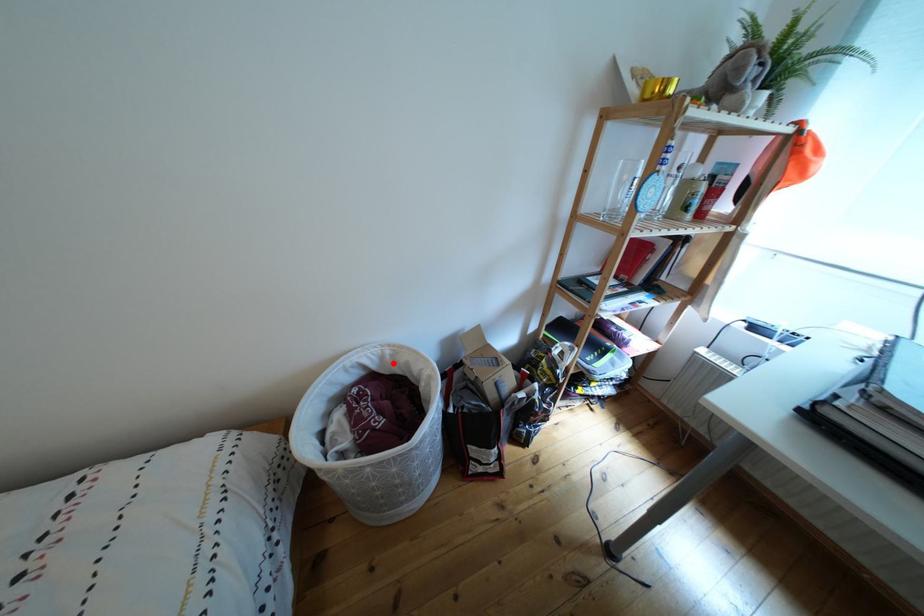
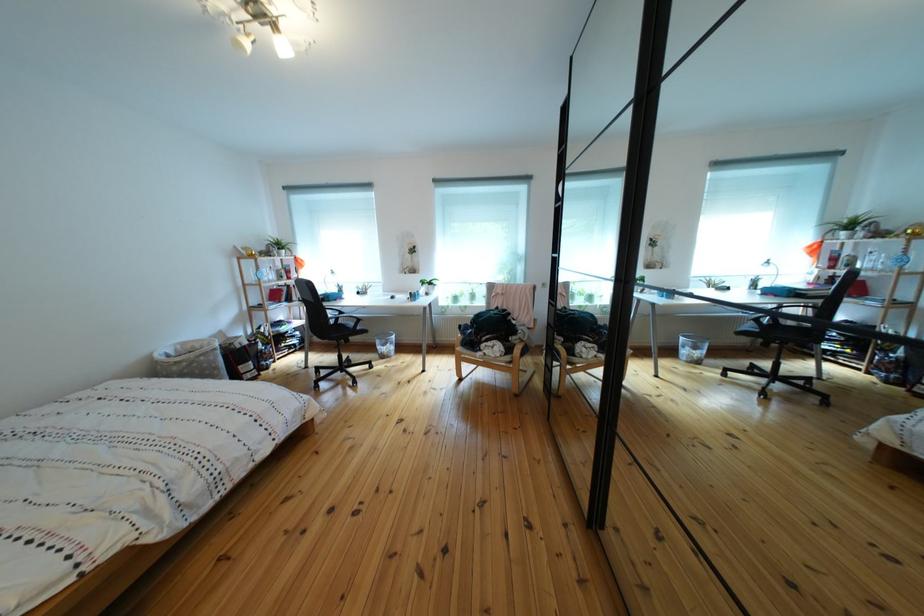
In the second image, find the point that corresponds to the highlighted location in the first image.

(187, 355)